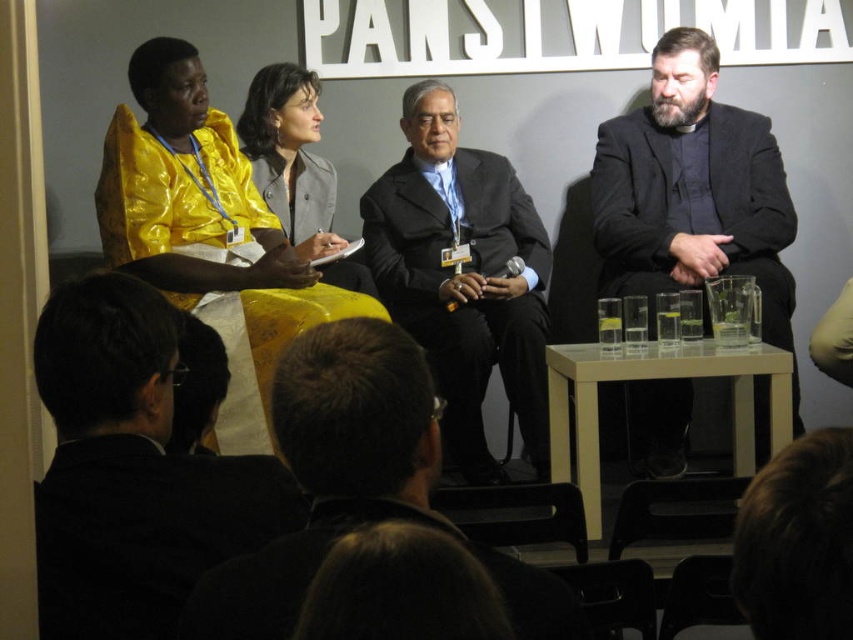
Based on the photo, can you confirm if black suit at left is taller than dark brown hair at center?

Yes, black suit at left is taller than dark brown hair at center.

In the scene shown: Does black suit at left have a smaller size compared to dark brown hair at center?

No.

Is point (103, 580) in front of point (190, 637)?

That is False.

Locate an element on the screen. The width and height of the screenshot is (853, 640). black suit at left is located at coordinates (132, 472).

Who is higher up, black suit at left or dark gray suit at center?

dark gray suit at center is above.

Between black suit at left and dark gray suit at center, which one is positioned lower?

black suit at left

Who is more forward, [105,538] or [456,285]?

Point [105,538] is in front.

Where is `black suit at left`? black suit at left is located at coordinates (132, 472).

Is dark brown hair at center above dark gray suit at center?

No.

Can you confirm if dark brown hair at center is positioned below dark gray suit at center?

Yes.

Locate an element on the screen. Image resolution: width=853 pixels, height=640 pixels. dark brown hair at center is located at coordinates (357, 484).